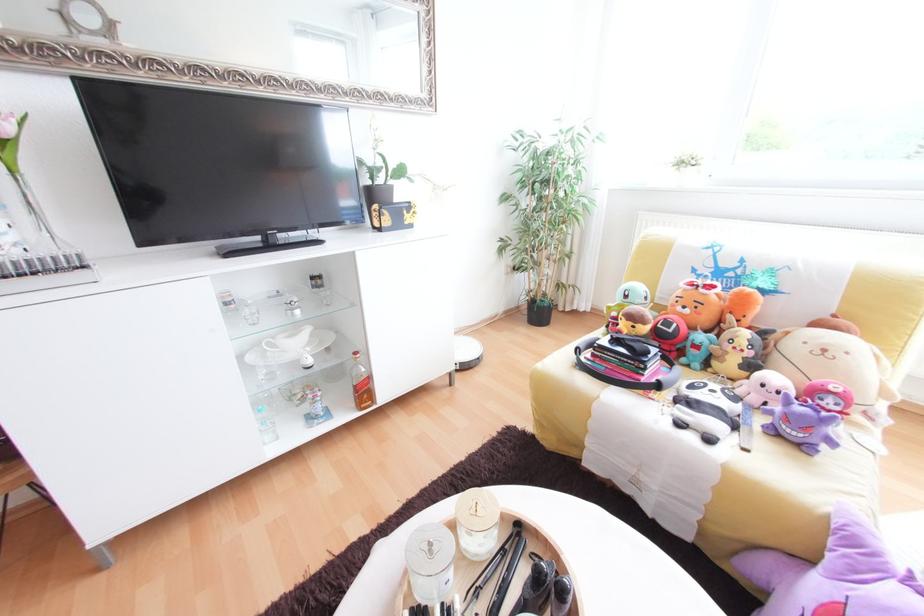
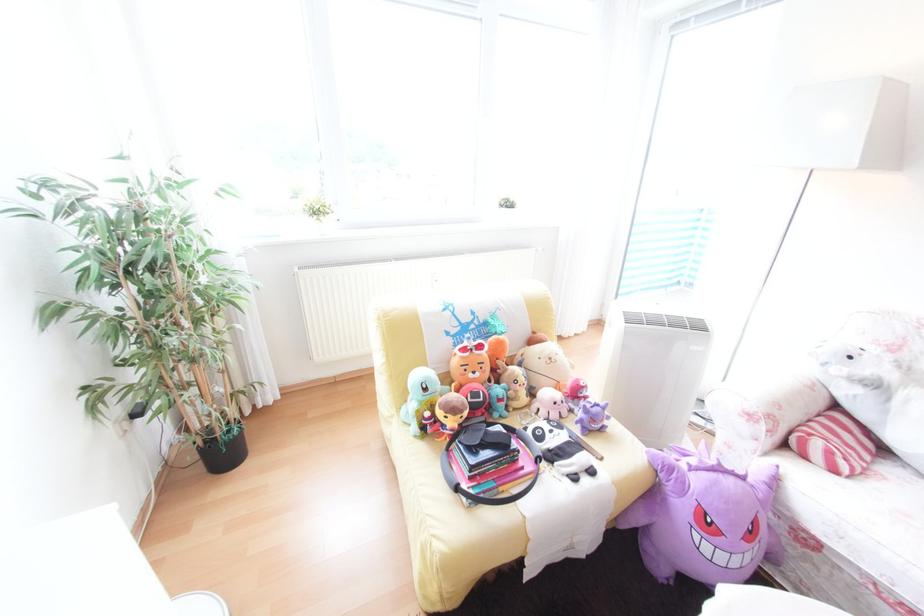
Where in the second image is the point corresponding to [652,370] from the first image?

(526, 455)